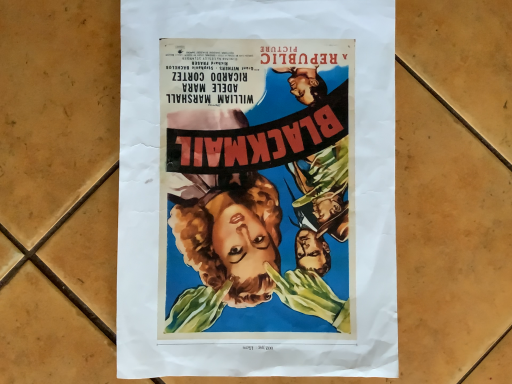
Question: Should I look upward or downward to see matte paper poster at center?

Choices:
 (A) up
 (B) down

Answer: (A)